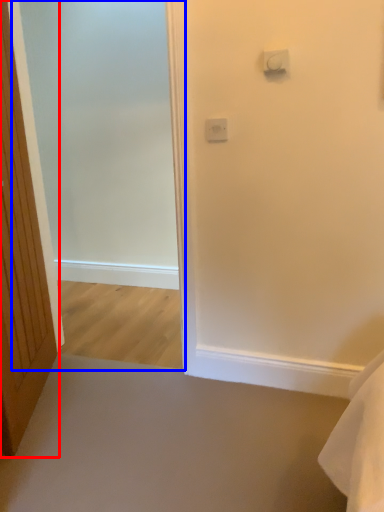
Question: Which object is further to the camera taking this photo, door (highlighted by a red box) or screen door (highlighted by a blue box)?

Choices:
 (A) door
 (B) screen door

Answer: (B)